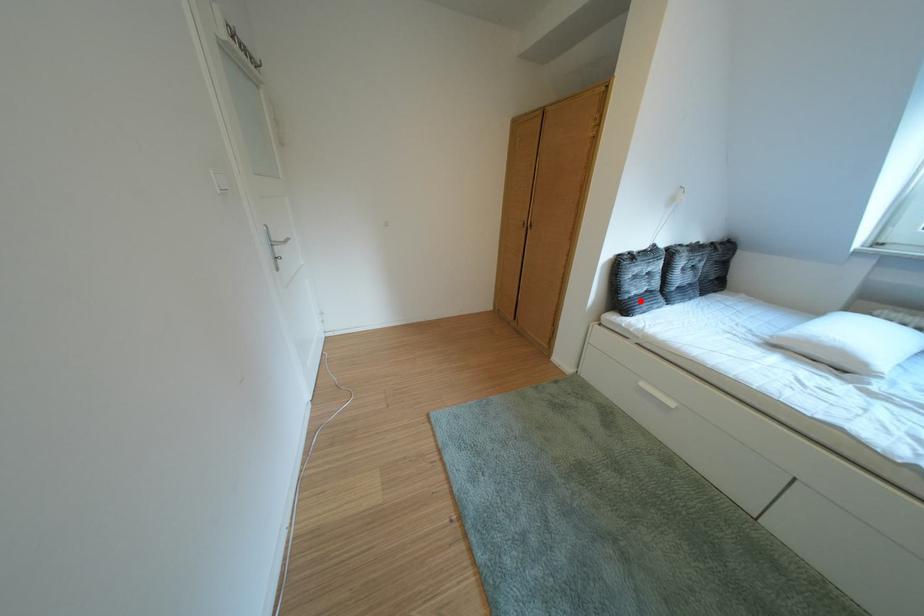
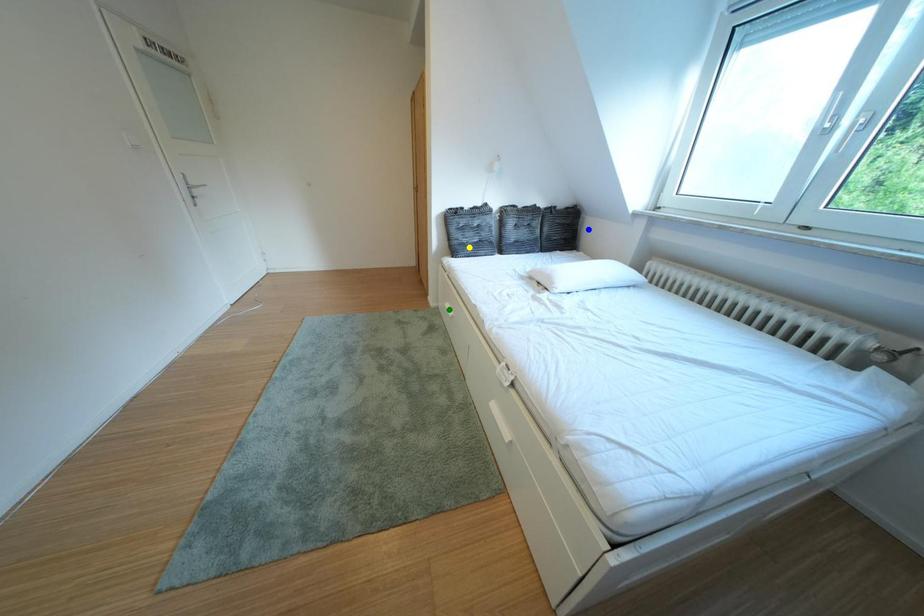
Question: I am providing you with two images of the same scene from different viewpoints. A red point is marked on the first image. You are given multiple points on the second image. In image 2, which mark is for the same physical point as the one in image 1?

Choices:
 (A) blue point
 (B) yellow point
 (C) green point

Answer: (B)